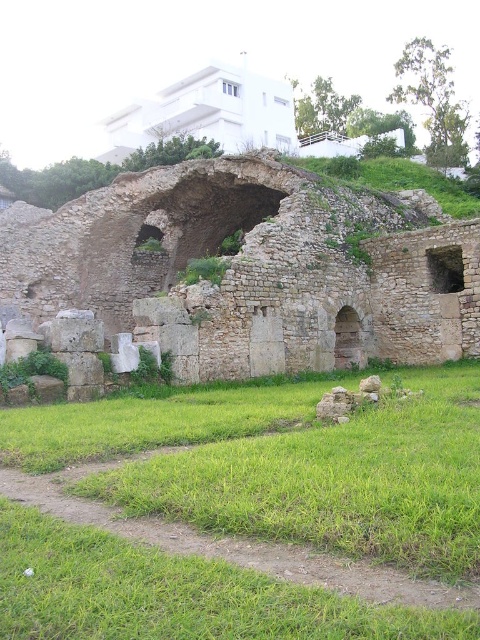
You are standing in front of the ancient stone structure and want to walk towards the green grass at center. Which direction should you move relative to the stone archway at center?

The green grass at center is positioned on the right side of the stone archway at center, so you should move to the right of the stone archway at center to reach the green grass at center.

In the scene shown: You are a landscape architect planning to install a new pathway between the green grass at center and the stone archway at center. Which area has more space to accommodate a wider path?

The stone archway at center has a greater width than the green grass at center, so the area around the stone archway at center can accommodate a wider path.

You are standing at the point marked by the coordinates in the image. Looking around, you see the ancient stone structure and the modern white building. Which direction should you face to see the green grass at center located at point (288, 461)?

You should face the direction of the green grass at center located at point (288, 461) because that is where it is situated.